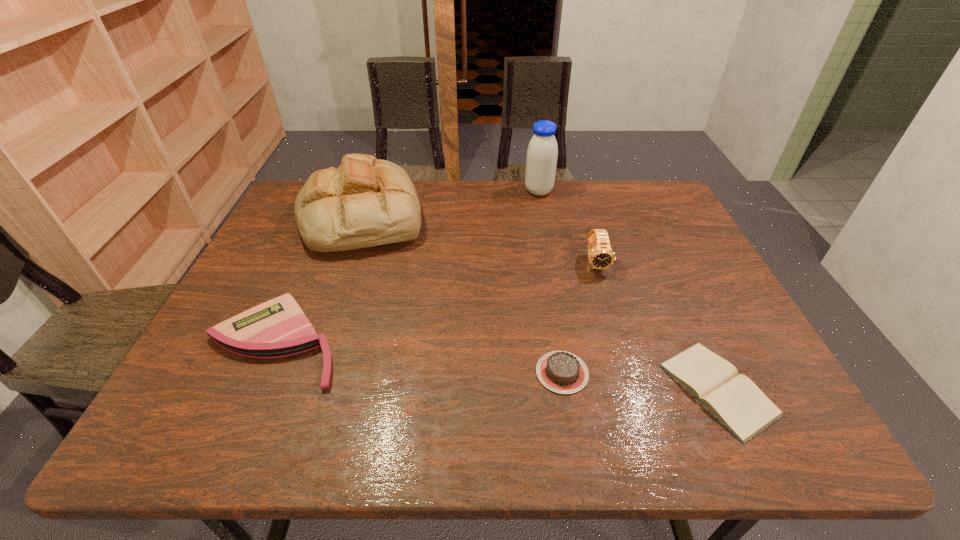
You are a GUI agent. You are given a task and a screenshot of the screen. Output one action in this format:
    pyautogui.click(x=<x>, y=<y>)
    Task: Click on the soya milk
    
    Given the screenshot: What is the action you would take?
    pyautogui.click(x=542, y=153)

I want to click on bread, so click(x=365, y=202).

Find the location of a particular element. The image size is (960, 540). the third tallest object is located at coordinates (600, 255).

I want to click on watch, so click(x=600, y=255).

Find the location of a particular element. This screenshot has height=540, width=960. wristlet is located at coordinates (277, 328).

The image size is (960, 540). What are the coordinates of `chocolate cake` in the screenshot? It's located at (562, 372).

Locate an element on the screen. The image size is (960, 540). Bible is located at coordinates pos(733,399).

Locate an element on the screen. the rightmost object is located at coordinates (733, 399).

This screenshot has height=540, width=960. In order to click on vacant space positioned 0.220m on the left of the tallest object in this screenshot , I will do `click(458, 191)`.

The height and width of the screenshot is (540, 960). I want to click on vacant area situated 0.260m on the front of the bread, so 322,333.